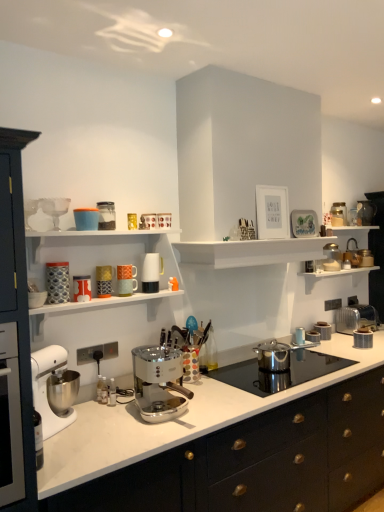
Question: Is metallic gold coffee maker at upper center, the ninth kitchen appliance positioned from the right, in front of or behind white matte shelf at upper center in the image?

Choices:
 (A) behind
 (B) front

Answer: (B)

Question: Is metallic gold coffee maker at upper center, the ninth kitchen appliance positioned from the right, bigger or smaller than white matte shelf at upper center?

Choices:
 (A) small
 (B) big

Answer: (A)

Question: Which object is positioned closest to the white plastic mixer at left, the 1th mixer viewed from the left?

Choices:
 (A) metallic gold canister at upper right, the 3th kitchen appliance from the right
 (B) stainless steel pot at center, placed as the 8th kitchen appliance when sorted from front to back
 (C) matte ceramic mug at upper center, the 7th kitchen appliance positioned from the front
 (D) patterned ceramic mug at left, marked as the twelfth kitchen appliance in a back-to-front arrangement
 (E) matte ceramic mug at upper center, which is the 7th kitchen appliance in back-to-front order

Answer: (D)

Question: Which object is positioned closest to the clear glass goblet at upper left, which is the seventh appliance in bottom-to-top order?

Choices:
 (A) stainless steel pot at center, the fifth kitchen appliance viewed from the back
 (B) metallic silver kettle at upper right, the 6th appliance in the left-to-right sequence
 (C) silver metallic canister at right, positioned as the 4th kitchen appliance in back-to-front order
 (D) metallic gold coffee maker at upper center, positioned as the 4th kitchen appliance in front-to-back order
 (E) metallic silver toaster at upper right, which appears as the 5th appliance when viewed from the left

Answer: (D)